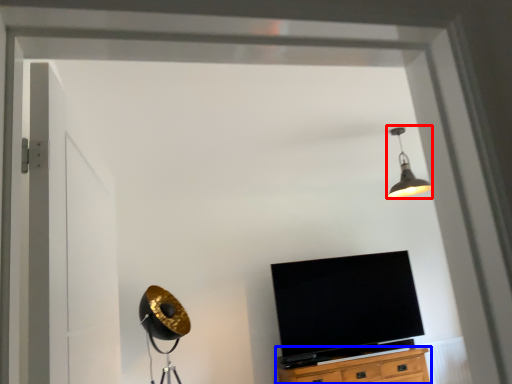
Question: Which object appears closest to the camera in this image, light fixture (highlighted by a red box) or cabinetry (highlighted by a blue box)?

Choices:
 (A) light fixture
 (B) cabinetry

Answer: (A)